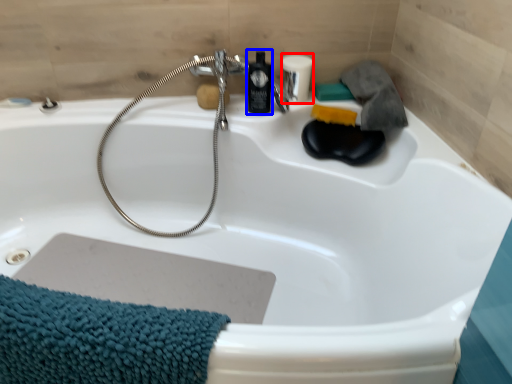
Question: Which object appears closest to the camera in this image, toiletry (highlighted by a red box) or mouthwash (highlighted by a blue box)?

Choices:
 (A) toiletry
 (B) mouthwash

Answer: (B)